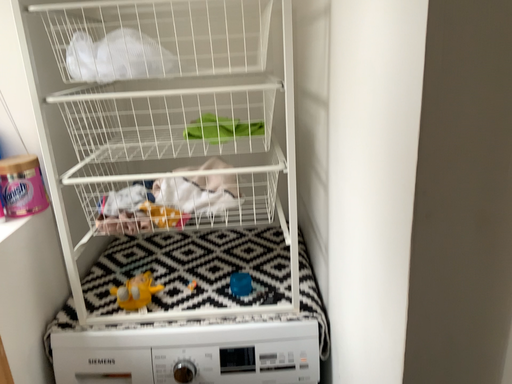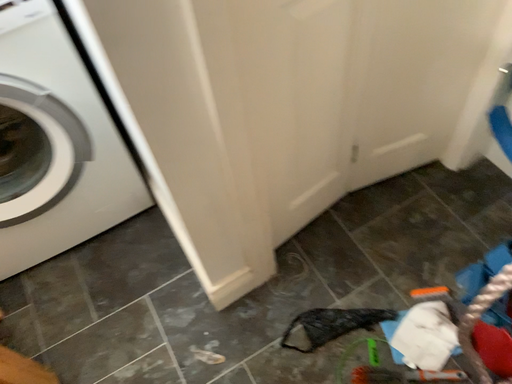
Question: Which way did the camera rotate in the video?

Choices:
 (A) rotated right
 (B) rotated left

Answer: (A)